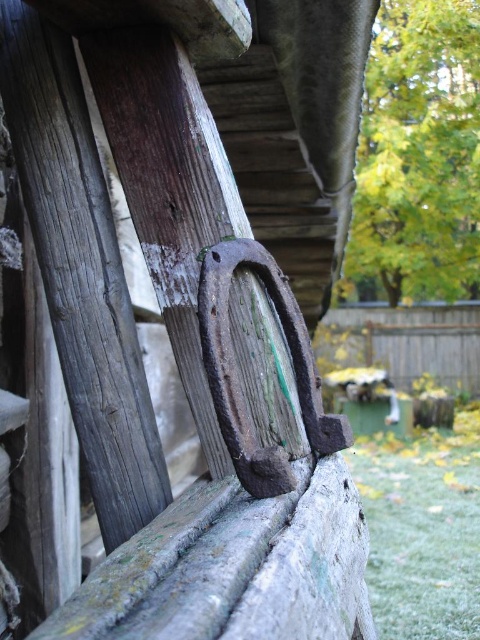
You are standing in a garden and see the green leafy tree at upper right and the green grass at lower right. Which one is wider?

The green grass at lower right is wider than the green leafy tree at upper right.

In the scene shown: You are standing in a garden and see the green leafy tree at upper right and the green grass at lower right. Which object is positioned higher up in the scene?

The green leafy tree at upper right is positioned higher up in the scene than the green grass at lower right.

Based on the scene description, which object is taller between the green leafy tree at upper right and the green grass at lower right?

The green leafy tree at upper right is much taller than the green grass at lower right.